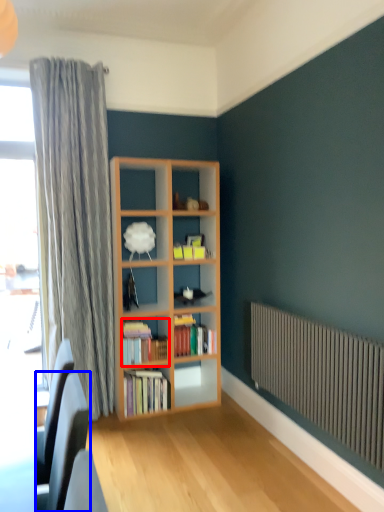
Question: Which object appears farthest to the camera in this image, book (highlighted by a red box) or swivel chair (highlighted by a blue box)?

Choices:
 (A) book
 (B) swivel chair

Answer: (A)